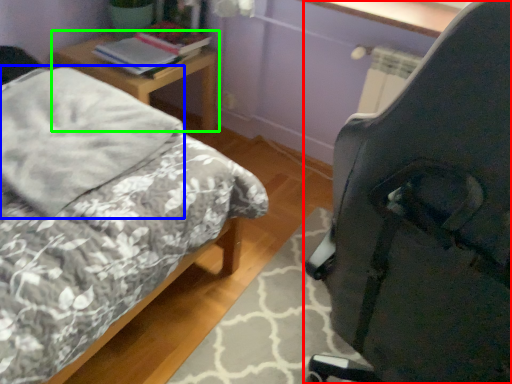
Question: Based on their relative distances, which object is nearer to chair (highlighted by a red box)? Choose from pillow (highlighted by a blue box) and nightstand (highlighted by a green box).

Choices:
 (A) pillow
 (B) nightstand

Answer: (A)